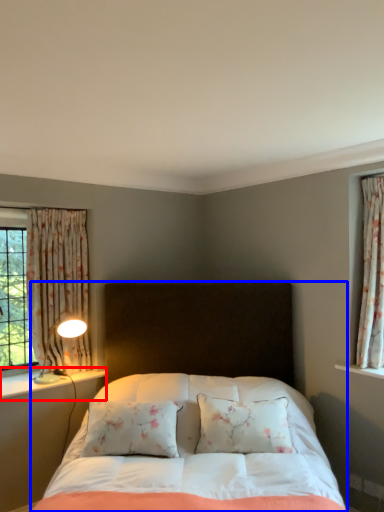
Question: Which object is closer to the camera taking this photo, window sill (highlighted by a red box) or bed (highlighted by a blue box)?

Choices:
 (A) window sill
 (B) bed

Answer: (B)